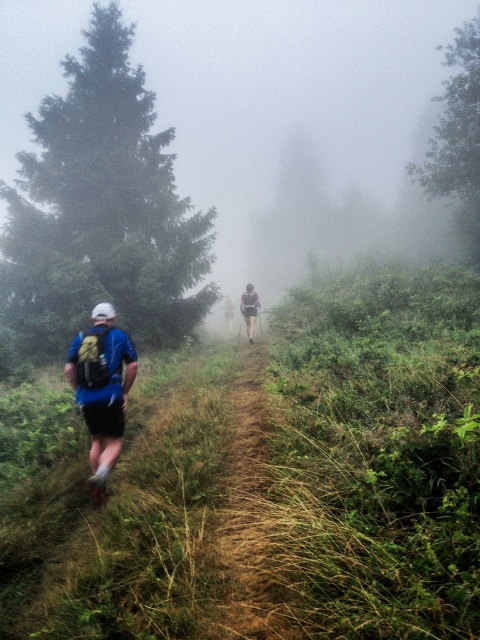
You are a hiker planning to carry both the blue fabric backpack at left and the green fabric backpack at center on your trip. Which backpack should you choose if you want to carry more items?

The green fabric backpack at center is larger than the blue fabric backpack at left, so it can carry more items.

You are a hiker trying to follow the trail. You see the brown grassy trail at center and the blue fabric backpack at left. Which object is closer to you?

The brown grassy trail at center is closer to you because it is in front of the blue fabric backpack at left.